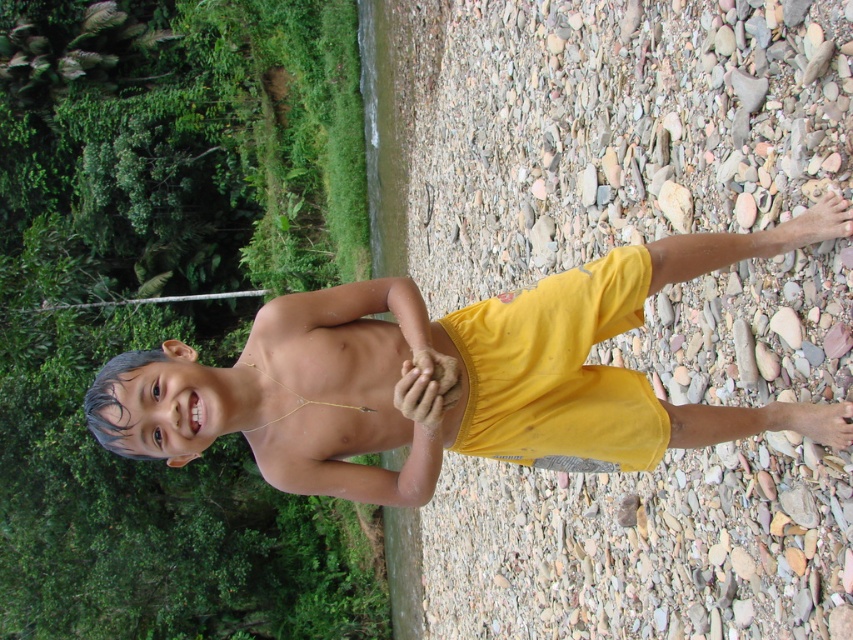
Based on the photo, you are the boy in the image and want to throw a pebble from your current position to hit a target located at point (210, 292). Which direction should you aim relative to your position at point (828, 412)?

You should aim towards the lower left direction because point (210, 292) is located to the lower left of your position at point (828, 412).